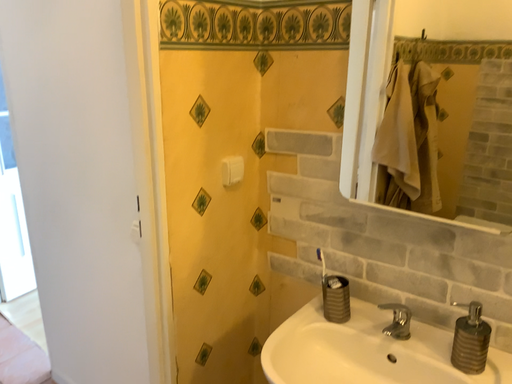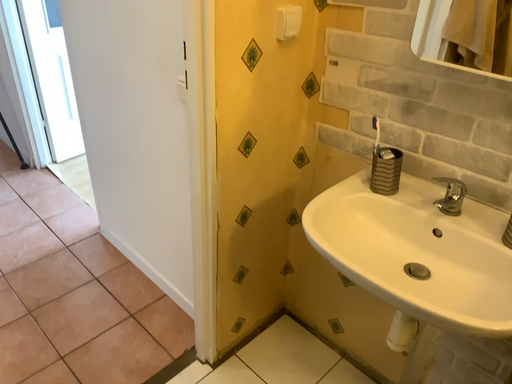
Question: Which way did the camera rotate in the video?

Choices:
 (A) rotated downward
 (B) rotated upward

Answer: (A)